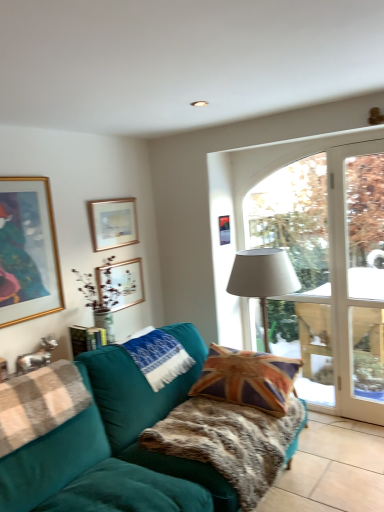
Question: Does white glass door at right appear on the right side of white knitted pillow at center, which appears as the first pillow when viewed from the left?

Choices:
 (A) no
 (B) yes

Answer: (B)

Question: Considering the relative positions of white glass door at right and white knitted pillow at center, which appears as the second pillow when viewed from the right, in the image provided, is white glass door at right behind white knitted pillow at center, which appears as the second pillow when viewed from the right,?

Choices:
 (A) no
 (B) yes

Answer: (B)

Question: Considering the relative sizes of white glass door at right and white knitted pillow at center, which appears as the second pillow when viewed from the right, in the image provided, is white glass door at right smaller than white knitted pillow at center, which appears as the second pillow when viewed from the right,?

Choices:
 (A) no
 (B) yes

Answer: (A)

Question: Is white glass door at right to the left of white knitted pillow at center, which appears as the first pillow when viewed from the left, from the viewer's perspective?

Choices:
 (A) no
 (B) yes

Answer: (A)

Question: Considering the relative sizes of white glass door at right and white knitted pillow at center, which appears as the first pillow when viewed from the left, in the image provided, is white glass door at right bigger than white knitted pillow at center, which appears as the first pillow when viewed from the left,?

Choices:
 (A) no
 (B) yes

Answer: (B)

Question: From a real-world perspective, is gold-framed picture at upper left, positioned as the fourth picture frame in right-to-left order, positioned above or below union jack fabric pillow at center, the 2th pillow in the left-to-right sequence?

Choices:
 (A) above
 (B) below

Answer: (A)

Question: In terms of height, does gold-framed picture at upper left, the first picture frame positioned from the left, look taller or shorter compared to union jack fabric pillow at center, the 2th pillow in the left-to-right sequence?

Choices:
 (A) tall
 (B) short

Answer: (A)

Question: From the image's perspective, relative to union jack fabric pillow at center, which appears as the 1th pillow when viewed from the right, is gold-framed picture at upper left, the first picture frame positioned from the left, above or below?

Choices:
 (A) above
 (B) below

Answer: (A)

Question: Relative to union jack fabric pillow at center, which appears as the 1th pillow when viewed from the right, is gold-framed picture at upper left, the first picture frame positioned from the left, in front or behind?

Choices:
 (A) behind
 (B) front

Answer: (A)

Question: Considering the positions of union jack fabric pillow at center, the 2th pillow in the left-to-right sequence, and white fabric lampshade at center in the image, is union jack fabric pillow at center, the 2th pillow in the left-to-right sequence, bigger or smaller than white fabric lampshade at center?

Choices:
 (A) small
 (B) big

Answer: (A)

Question: Looking at their shapes, would you say union jack fabric pillow at center, which appears as the 1th pillow when viewed from the right, is wider or thinner than white fabric lampshade at center?

Choices:
 (A) wide
 (B) thin

Answer: (A)

Question: Considering their positions, is union jack fabric pillow at center, which appears as the 1th pillow when viewed from the right, located in front of or behind white fabric lampshade at center?

Choices:
 (A) behind
 (B) front

Answer: (B)

Question: Based on their positions, is union jack fabric pillow at center, the 2th pillow in the left-to-right sequence, located to the left or right of white fabric lampshade at center?

Choices:
 (A) right
 (B) left

Answer: (B)

Question: Choose the correct answer: Is metallic gold picture frame at upper center, placed as the 1th picture frame when sorted from right to left, inside matte gold picture frame at upper center, which is counted as the 2th picture frame, starting from the left, or outside it?

Choices:
 (A) outside
 (B) inside

Answer: (A)

Question: Relative to matte gold picture frame at upper center, the 3th picture frame positioned from the right, is metallic gold picture frame at upper center, placed as the 1th picture frame when sorted from right to left, in front or behind?

Choices:
 (A) behind
 (B) front

Answer: (A)